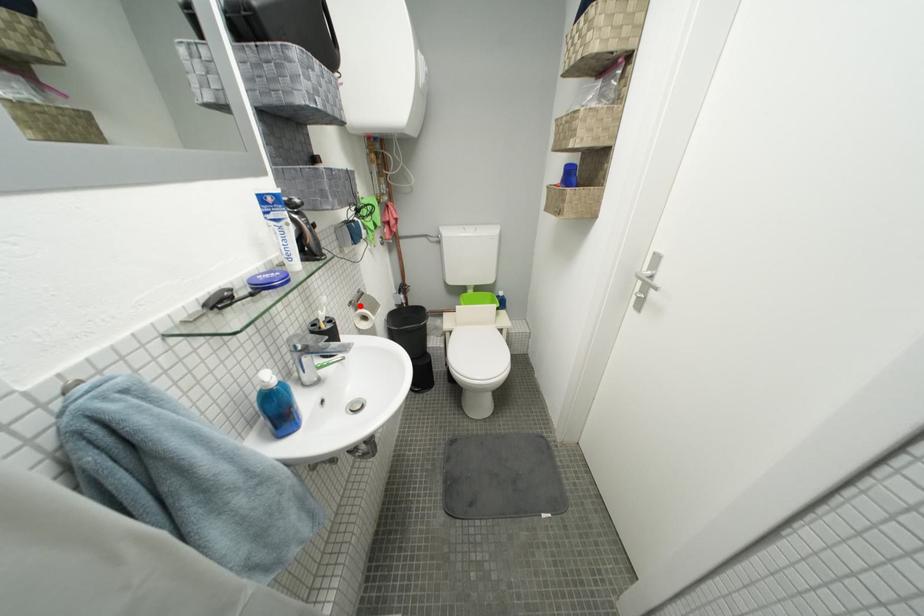
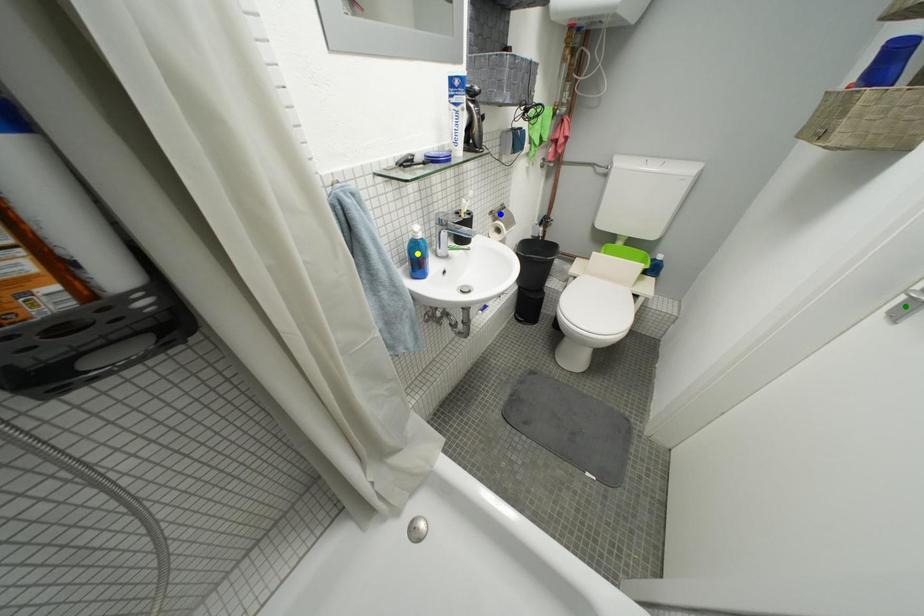
Question: I am providing you with two images of the same scene from different viewpoints. A red point is marked on the first image. You are given multiple points on the second image. Which mark in image 2 goes with the point in image 1?

Choices:
 (A) yellow point
 (B) blue point
 (C) green point

Answer: (B)